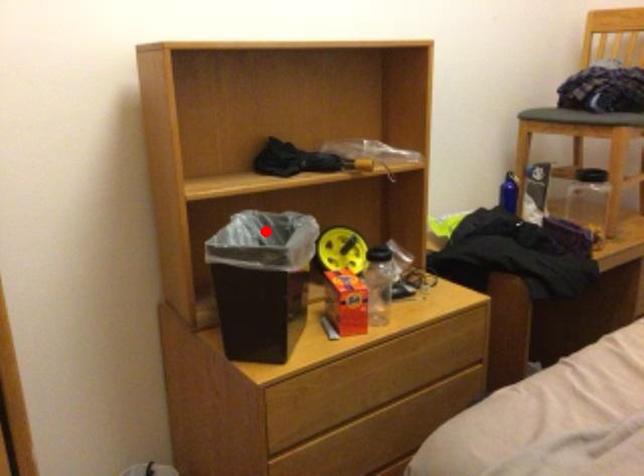
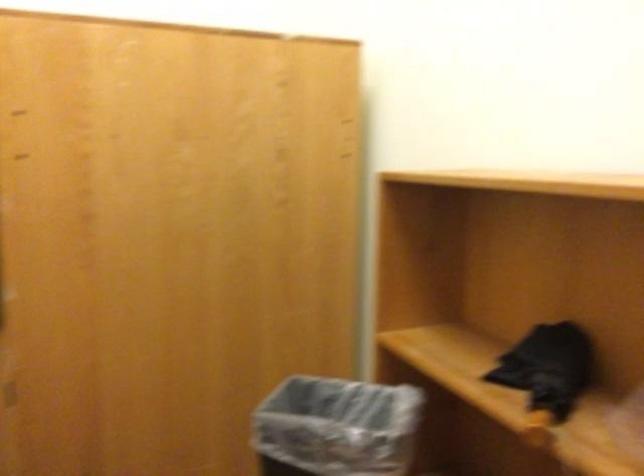
Locate, in the second image, the point that corresponds to the highlighted location in the first image.

(337, 426)